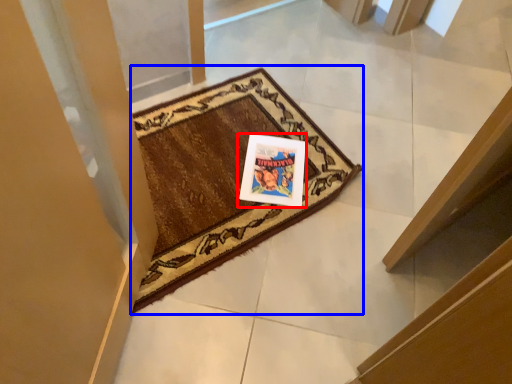
Question: Which object appears closest to the camera in this image, picture frame (highlighted by a red box) or mat (highlighted by a blue box)?

Choices:
 (A) picture frame
 (B) mat

Answer: (B)